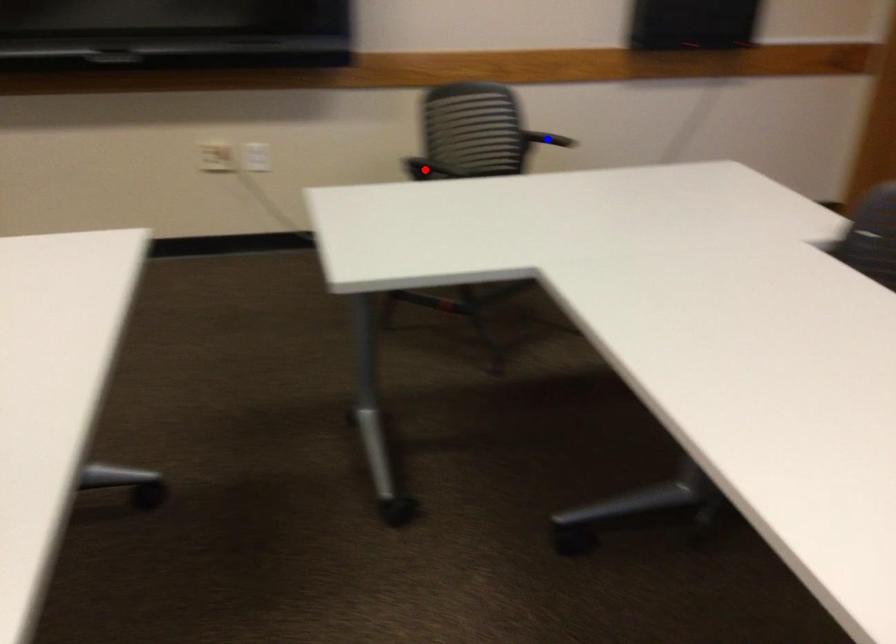
Question: Which of the two points in the image is closer to the camera?

Choices:
 (A) Blue point is closer.
 (B) Red point is closer.

Answer: (B)